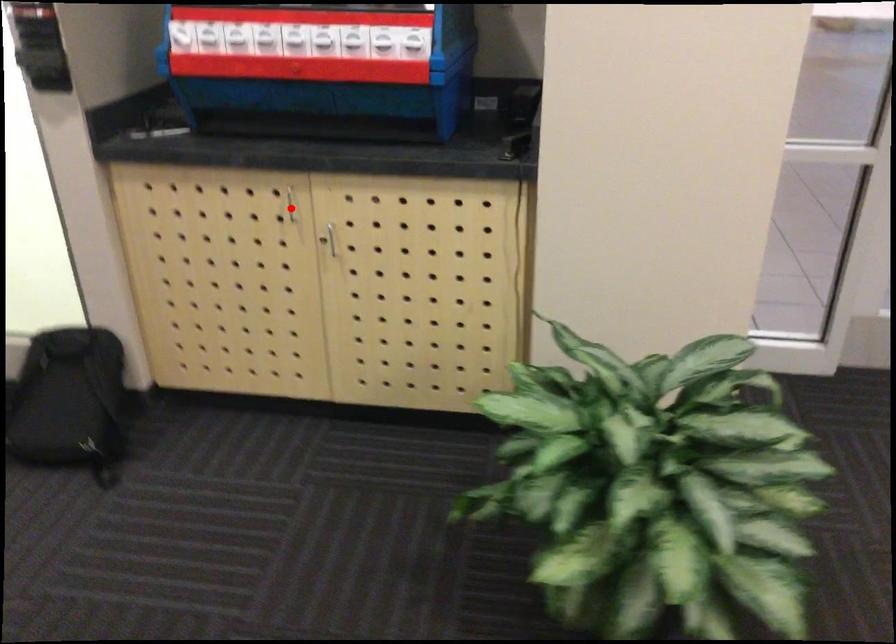
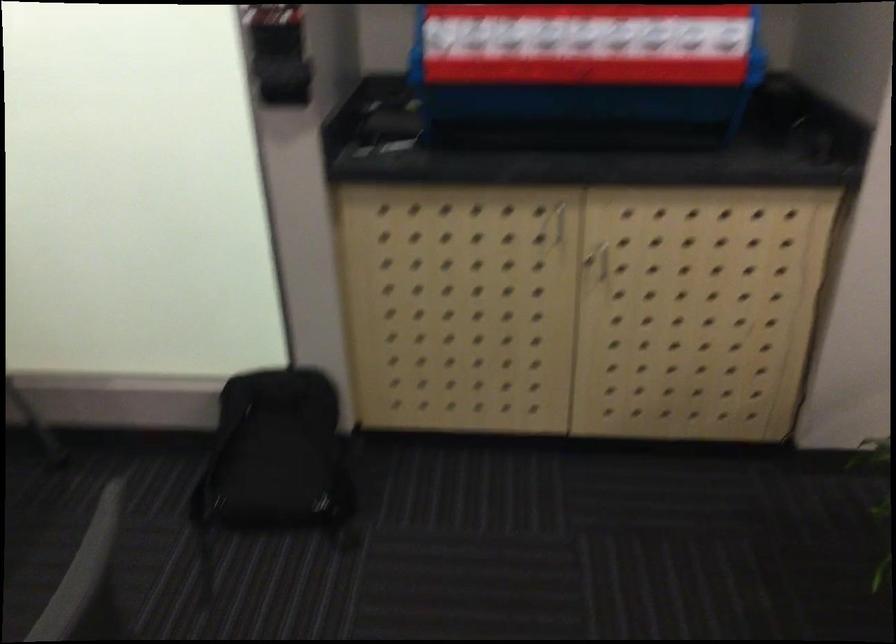
Question: I am providing you with two images of the same scene from different viewpoints. Given a red point in image1, look at the same physical point in image2. Is it:

Choices:
 (A) Closer to the viewpoint
 (B) Farther from the viewpoint

Answer: (A)